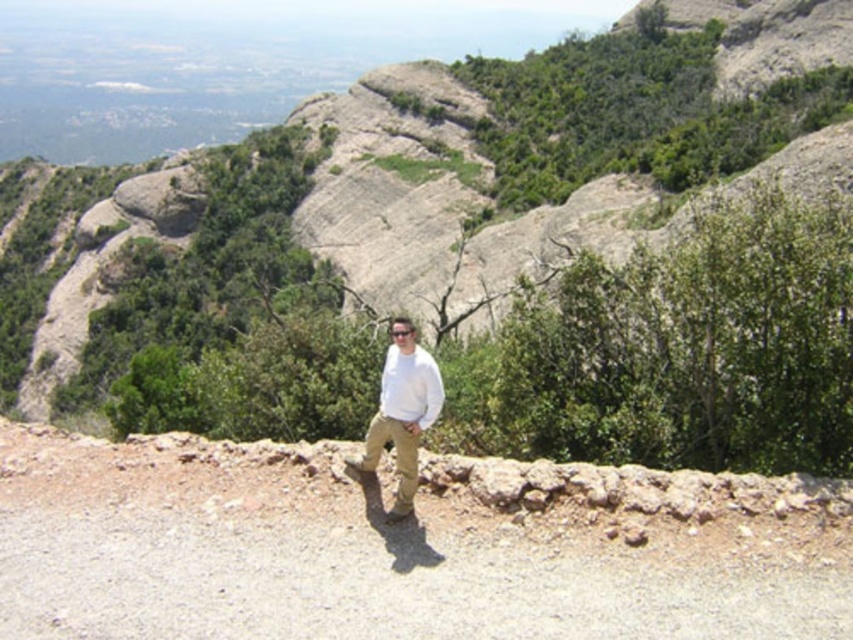
Question: Which object is closer to the camera taking this photo?

Choices:
 (A) gray rock formation at center
 (B) white cotton shirt at center

Answer: (B)

Question: Which object is farther from the camera taking this photo?

Choices:
 (A) gray rock formation at center
 (B) white cotton shirt at center

Answer: (A)

Question: Which point is farther to the camera?

Choices:
 (A) (686, 29)
 (B) (416, 472)

Answer: (A)

Question: Can you confirm if gray rock formation at center is positioned below white cotton shirt at center?

Choices:
 (A) yes
 (B) no

Answer: (B)

Question: Is gray rock formation at center thinner than white cotton shirt at center?

Choices:
 (A) no
 (B) yes

Answer: (A)

Question: Does gray rock formation at center come in front of white cotton shirt at center?

Choices:
 (A) no
 (B) yes

Answer: (A)